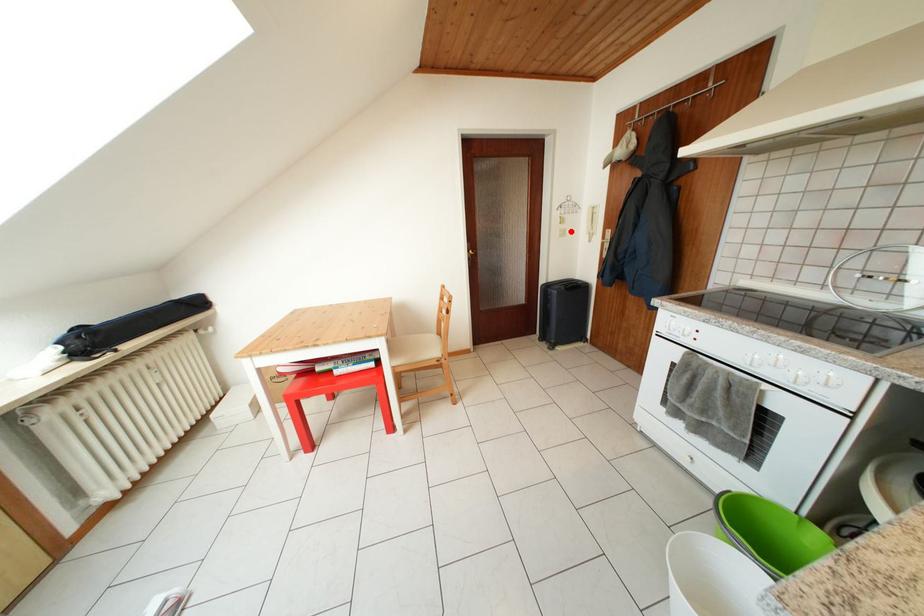
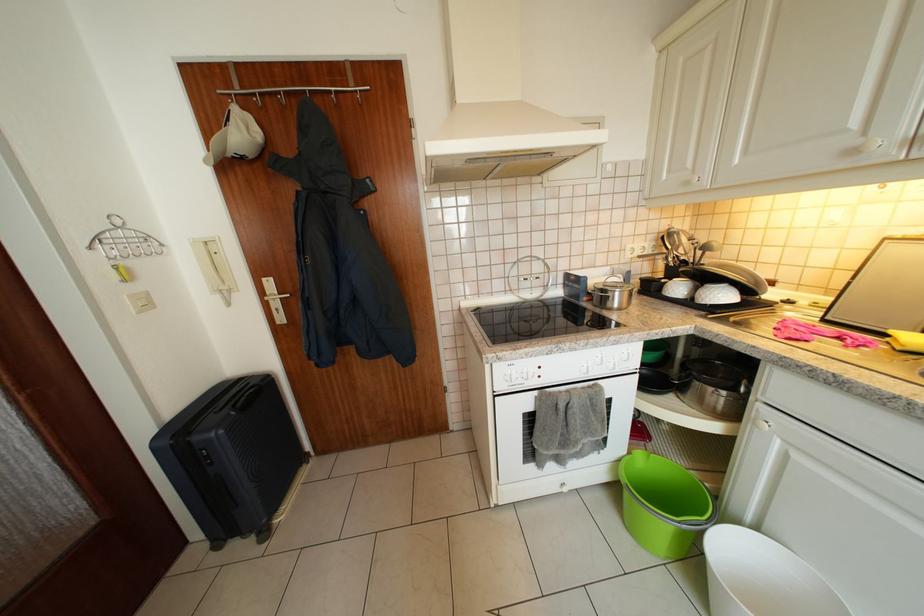
Question: I am providing you with two images of the same scene from different viewpoints. A red point is marked on the first image. Is the red point's position out of view in image 2?

Choices:
 (A) Yes
 (B) No

Answer: (B)